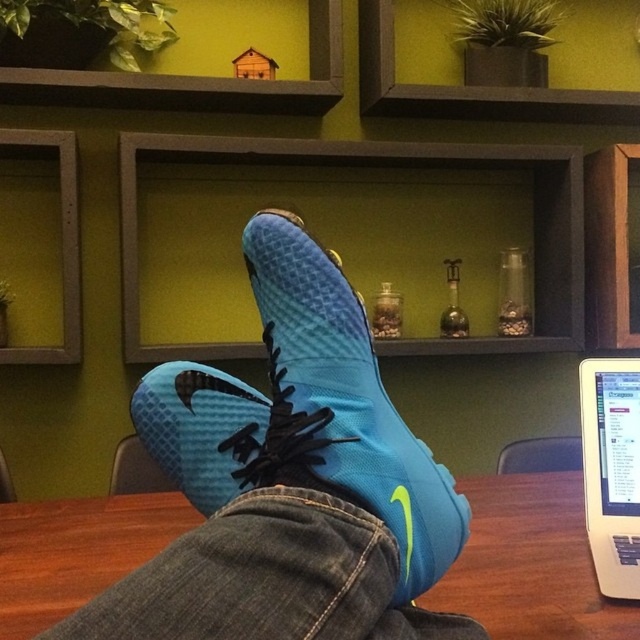
Does blue matte/synthetic shoe at center have a lesser height compared to blue mesh shoe at center?

No.

Which is above, blue matte/synthetic shoe at center or blue mesh shoe at center?

Positioned higher is blue mesh shoe at center.

The width and height of the screenshot is (640, 640). What do you see at coordinates (289, 481) in the screenshot? I see `blue matte/synthetic shoe at center` at bounding box center [289, 481].

Where is `blue matte/synthetic shoe at center`? blue matte/synthetic shoe at center is located at coordinates (289, 481).

Is point (3, 529) farther from viewer compared to point (586, 512)?

Yes, point (3, 529) is behind point (586, 512).

Looking at this image, can you confirm if wooden table at center is positioned below white plastic laptop at upper right?

Correct, wooden table at center is located below white plastic laptop at upper right.

The height and width of the screenshot is (640, 640). I want to click on wooden table at center, so click(531, 564).

What are the coordinates of `wooden table at center` in the screenshot? It's located at (531, 564).

Can you confirm if blue mesh shoe at center is positioned above white plastic laptop at upper right?

Correct, blue mesh shoe at center is located above white plastic laptop at upper right.

Does blue mesh shoe at center have a smaller size compared to white plastic laptop at upper right?

Yes.

Locate an element on the screen. blue mesh shoe at center is located at coordinates (348, 400).

Identify the location of blue mesh shoe at center. (348, 400).